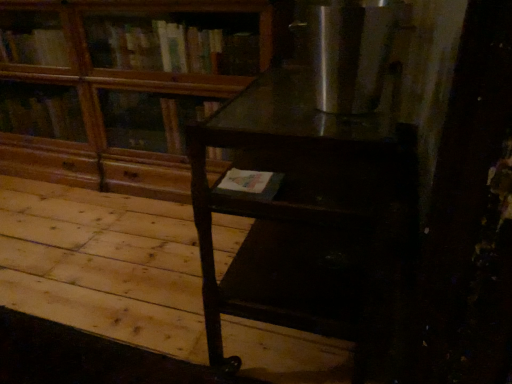
Where is `vacant space that is in between dark wood table at center and wooden at upper left`? vacant space that is in between dark wood table at center and wooden at upper left is located at coordinates (111, 240).